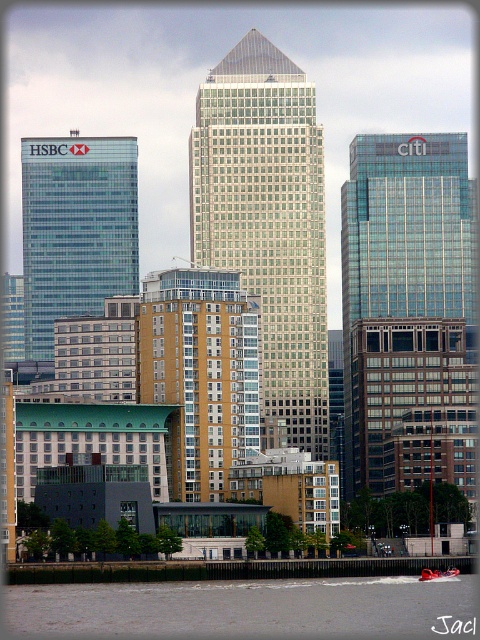
Question: Is glassy blue skyscraper at right wider than gray concrete waterway at lower left?

Choices:
 (A) no
 (B) yes

Answer: (A)

Question: Does glassy blue skyscraper at right appear over glassy blue skyscraper at left?

Choices:
 (A) no
 (B) yes

Answer: (A)

Question: Which of the following is the farthest from the observer?

Choices:
 (A) glassy blue skyscraper at left
 (B) gray concrete waterway at lower left

Answer: (A)

Question: Among these objects, which one is farthest from the camera?

Choices:
 (A) glassy silver skyscraper at center
 (B) glassy blue skyscraper at left
 (C) glassy blue skyscraper at right
 (D) gray concrete waterway at lower left

Answer: (B)

Question: Does glassy blue skyscraper at right appear over gray concrete waterway at lower left?

Choices:
 (A) no
 (B) yes

Answer: (B)

Question: Which point appears closest to the camera in this image?

Choices:
 (A) (347, 305)
 (B) (253, 172)

Answer: (B)